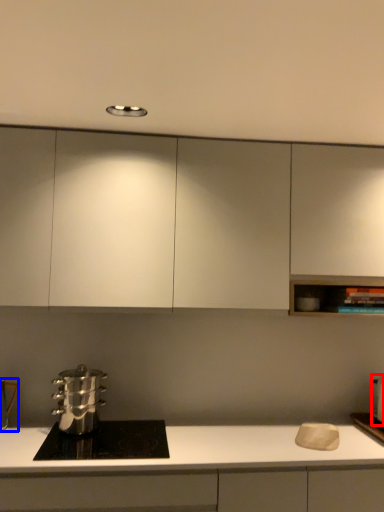
Question: Which point is closer to the camera, appliance (highlighted by a red box) or appliance (highlighted by a blue box)?

Choices:
 (A) appliance
 (B) appliance

Answer: (B)